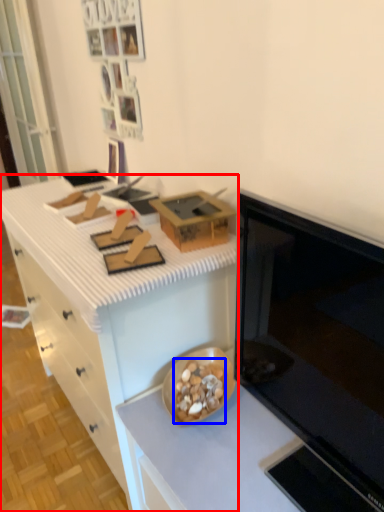
Question: Among these objects, which one is farthest to the camera, cabinetry (highlighted by a red box) or food (highlighted by a blue box)?

Choices:
 (A) cabinetry
 (B) food

Answer: (B)